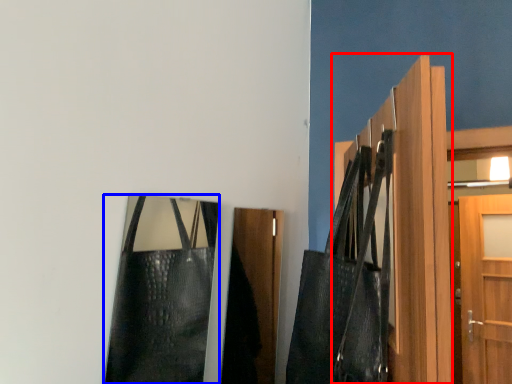
Question: Which object appears farthest to the camera in this image, door (highlighted by a red box) or bag (highlighted by a blue box)?

Choices:
 (A) door
 (B) bag

Answer: (B)